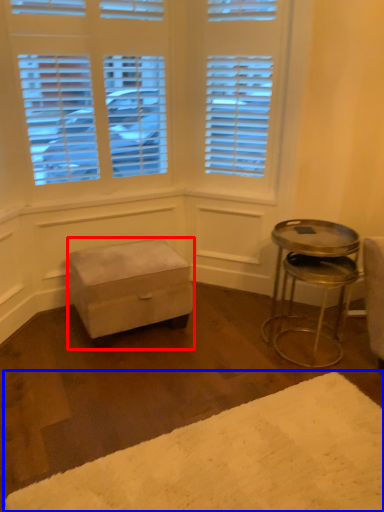
Question: Which object is further to the camera taking this photo, stool (highlighted by a red box) or plain (highlighted by a blue box)?

Choices:
 (A) stool
 (B) plain

Answer: (A)